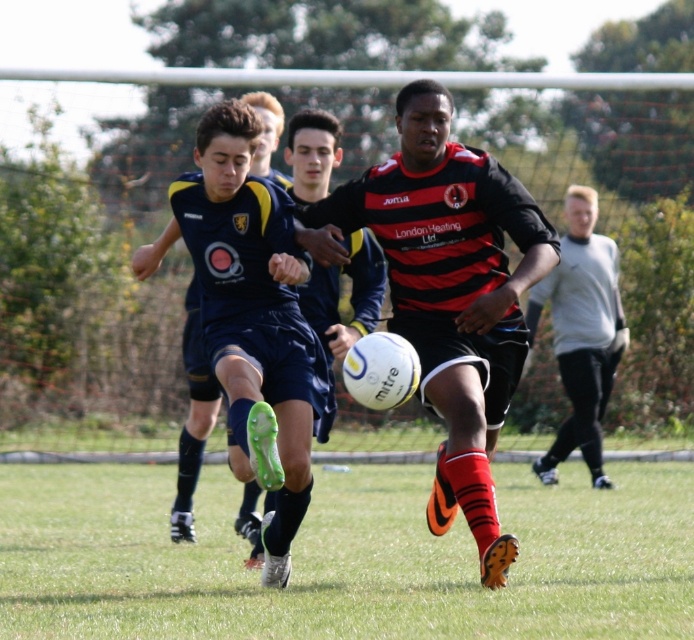
Question: Which of the following is the farthest from the observer?

Choices:
 (A) (514, 360)
 (B) (405, 611)

Answer: (A)

Question: Where is green grass at center located in relation to dark blue jersey at center in the image?

Choices:
 (A) below
 (B) above

Answer: (A)

Question: Can you confirm if green grass at center is thinner than dark blue jersey at center?

Choices:
 (A) no
 (B) yes

Answer: (B)

Question: Which of the following is the closest to the observer?

Choices:
 (A) green grass at center
 (B) black matte soccer ball at center
 (C) dark blue jersey at center
 (D) light gray fleece at right

Answer: (C)

Question: Estimate the real-world distances between objects in this image. Which object is closer to the light gray fleece at right?

Choices:
 (A) black matte soccer ball at center
 (B) green grass at center
 (C) dark blue jersey at center

Answer: (A)

Question: Observing the image, what is the correct spatial positioning of green grass at center in reference to light gray fleece at right?

Choices:
 (A) below
 (B) above

Answer: (A)